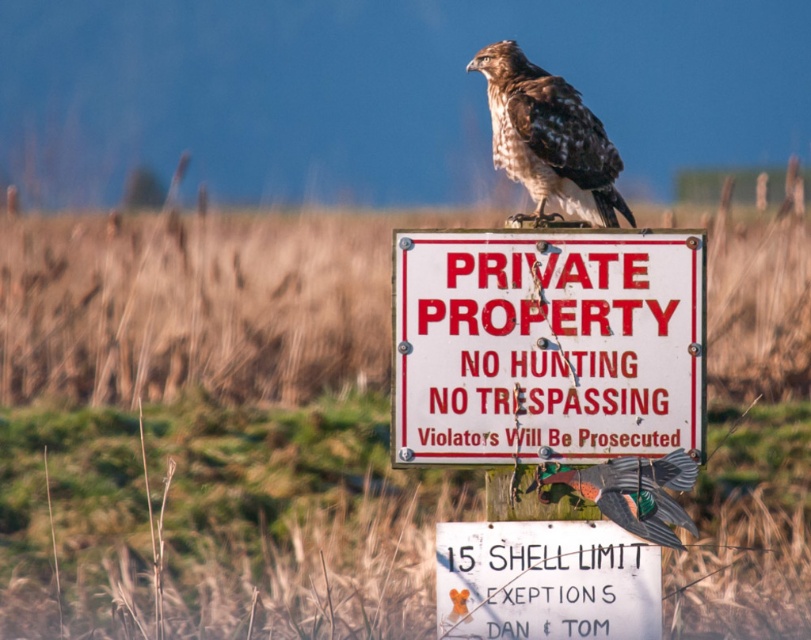
Question: Does brown speckled feathers at center have a lesser width compared to metallic gray bird at center?

Choices:
 (A) yes
 (B) no

Answer: (B)

Question: Does white painted metal sign at center appear on the right side of brown speckled feathers at center?

Choices:
 (A) no
 (B) yes

Answer: (A)

Question: Does brown wooden sign at center appear under white paper sign at center?

Choices:
 (A) yes
 (B) no

Answer: (B)

Question: Which point is closer to the camera?

Choices:
 (A) (500, 72)
 (B) (651, 502)
 (C) (172, 346)
 (D) (654, 280)

Answer: (B)

Question: Which point is closer to the camera?

Choices:
 (A) pyautogui.click(x=631, y=506)
 (B) pyautogui.click(x=471, y=268)
 (C) pyautogui.click(x=607, y=541)
 (D) pyautogui.click(x=492, y=109)

Answer: (B)

Question: Which point appears farthest from the camera in this image?

Choices:
 (A) (714, 628)
 (B) (545, 483)
 (C) (594, 522)
 (D) (586, 300)

Answer: (A)